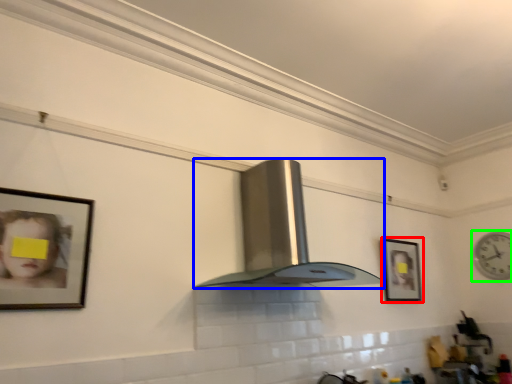
Question: Estimate the real-world distances between objects in this image. Which object is farther from picture frame (highlighted by a red box), fume hood (highlighted by a blue box) or clock (highlighted by a green box)?

Choices:
 (A) fume hood
 (B) clock

Answer: (B)